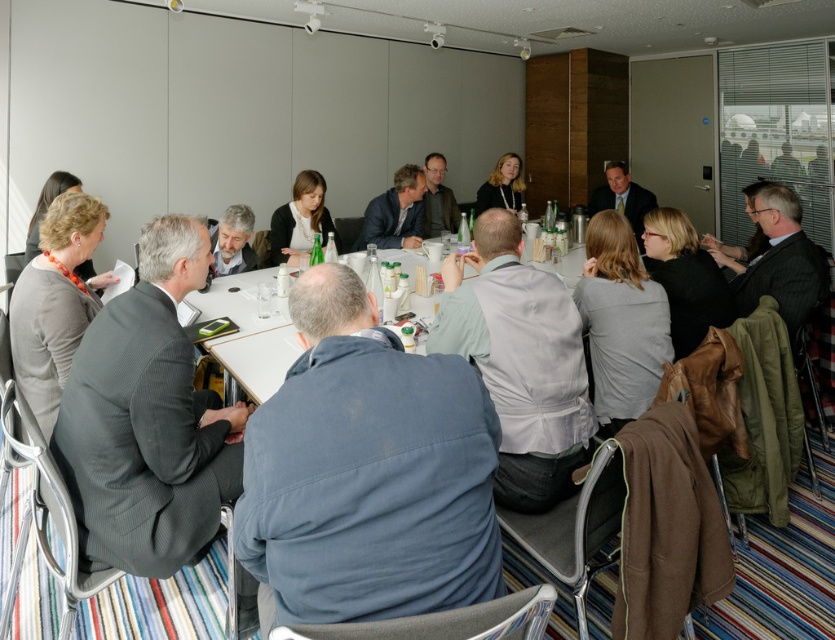
Does matte blue shirt at center appear over matte black shirt at center?

Correct, matte blue shirt at center is located above matte black shirt at center.

Does matte blue shirt at center have a lesser width compared to matte black shirt at center?

No, matte blue shirt at center is not thinner than matte black shirt at center.

Locate an element on the screen. matte blue shirt at center is located at coordinates point(395,212).

Can you confirm if white glossy table at center is shorter than matte black shirt at center?

Correct, white glossy table at center is not as tall as matte black shirt at center.

Between point (286, 326) and point (322, 212), which one is positioned in front?

Point (286, 326) is more forward.

This screenshot has height=640, width=835. Find the location of `white glossy table at center`. white glossy table at center is located at coordinates (249, 336).

Is blue cotton shirt at center in front of matte black jacket at upper center?

Yes, it is in front of matte black jacket at upper center.

Is blue cotton shirt at center to the left of matte black jacket at upper center from the viewer's perspective?

Yes, blue cotton shirt at center is to the left of matte black jacket at upper center.

This screenshot has width=835, height=640. What are the coordinates of `blue cotton shirt at center` in the screenshot? It's located at (367, 472).